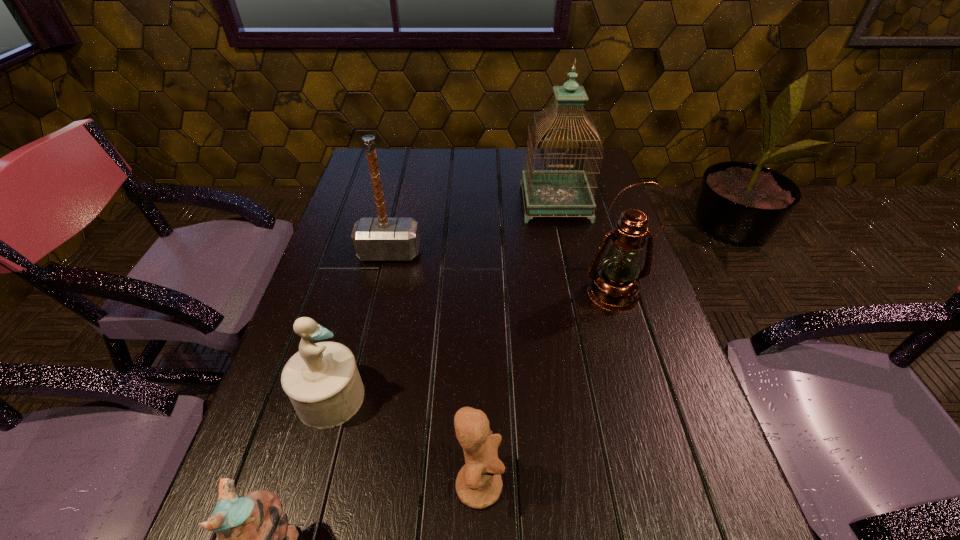
Where is `free location at the right edge of the desktop`? The image size is (960, 540). free location at the right edge of the desktop is located at coordinates (614, 220).

The width and height of the screenshot is (960, 540). In the image, there is a desktop. What are the coordinates of `vacant space at the far left corner` in the screenshot? It's located at (389, 148).

Identify the location of vacant area at the far right corner of the desktop. The image size is (960, 540). (583, 161).

I want to click on unoccupied position between the third nearest object and the oil lamp, so click(471, 346).

Find the location of a particular element. vacant space in between the birdcage and the oil lamp is located at coordinates (584, 248).

The image size is (960, 540). I want to click on empty space that is in between the tallest object and the fourth nearest object, so click(584, 248).

Where is `vacant region between the fourth nearest object and the farthest figurine`? The width and height of the screenshot is (960, 540). vacant region between the fourth nearest object and the farthest figurine is located at coordinates (471, 346).

Locate an element on the screen. vacant space in between the oil lamp and the second farthest figurine is located at coordinates (546, 389).

This screenshot has height=540, width=960. Identify the location of blank region between the third object from right to left and the second farthest object. (434, 369).

In order to click on the third closest object relative to the hammer in this screenshot , I will do `click(615, 285)`.